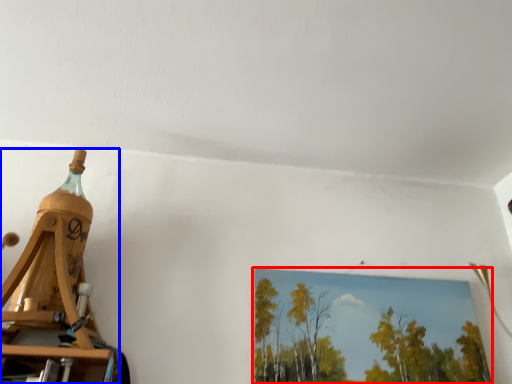
Question: Which point is further to the camera, picture frame (highlighted by a red box) or bottle (highlighted by a blue box)?

Choices:
 (A) picture frame
 (B) bottle

Answer: (A)